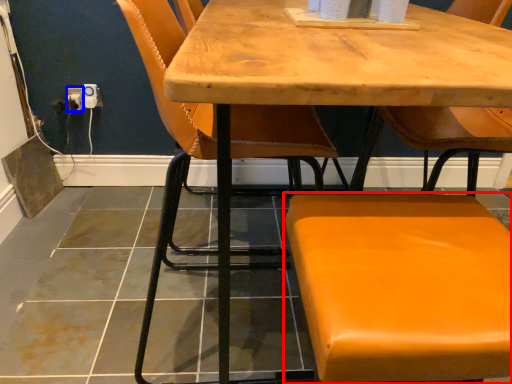
Question: Which point is further to the camera, chair (highlighted by a red box) or electric outlet (highlighted by a blue box)?

Choices:
 (A) chair
 (B) electric outlet

Answer: (B)